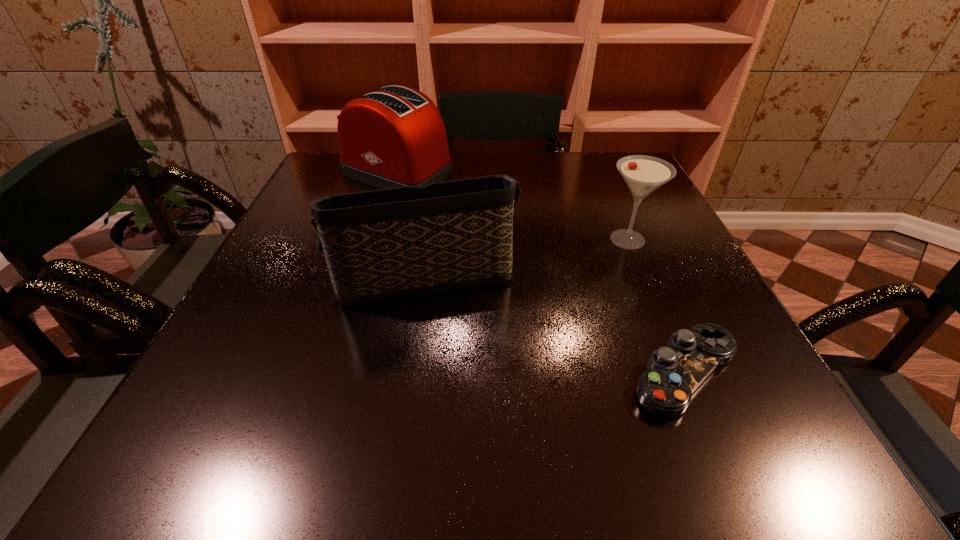
Identify the location of object at the near edge. (674, 372).

This screenshot has height=540, width=960. Identify the location of toaster that is at the left edge. (393, 137).

Find the location of a particular element. The height and width of the screenshot is (540, 960). handbag that is at the left edge is located at coordinates (385, 244).

The width and height of the screenshot is (960, 540). In order to click on martini present at the right edge in this screenshot , I will do 643,174.

Find the location of `control that is positioned at the right edge`. control that is positioned at the right edge is located at coordinates (674, 372).

At what (x,y) coordinates should I click in order to perform the action: click on object that is at the far left corner. Please return your answer as a coordinate pair (x, y). This screenshot has width=960, height=540. Looking at the image, I should click on (393, 137).

The width and height of the screenshot is (960, 540). What are the coordinates of `object that is positioned at the near right corner` in the screenshot? It's located at (674, 372).

Where is `vacant space at the far edge of the desktop`? The width and height of the screenshot is (960, 540). vacant space at the far edge of the desktop is located at coordinates (497, 171).

Identify the location of free point at the near edge. This screenshot has height=540, width=960. (307, 423).

Image resolution: width=960 pixels, height=540 pixels. Identify the location of free spot at the left edge of the desktop. tap(332, 289).